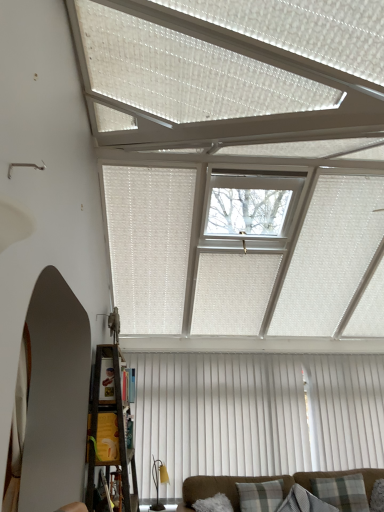
Image resolution: width=384 pixels, height=512 pixels. What do you see at coordinates (342, 492) in the screenshot? I see `plaid fabric pillow at lower right, which is the 3th pillow in left-to-right order` at bounding box center [342, 492].

The width and height of the screenshot is (384, 512). I want to click on white vertical blinds at center, so click(255, 415).

What do you see at coordinates (260, 496) in the screenshot? The image size is (384, 512). I see `plaid fabric pillow at lower center, which appears as the 1th pillow when viewed from the left` at bounding box center [260, 496].

At what (x,y) coordinates should I click in order to perform the action: click on brown fabric couch at lower center. Please return your answer as a coordinate pair (x, y). Looking at the image, I should click on (261, 481).

From the picture: What's the angular difference between plaid fabric pillow at lower center, the 3th pillow when ordered from right to left, and wooden bookshelf at lower left's facing directions?

77.1 degrees.

Considering the sizes of plaid fabric pillow at lower center, the 3th pillow when ordered from right to left, and wooden bookshelf at lower left in the image, is plaid fabric pillow at lower center, the 3th pillow when ordered from right to left, taller or shorter than wooden bookshelf at lower left?

plaid fabric pillow at lower center, the 3th pillow when ordered from right to left, is shorter than wooden bookshelf at lower left.

In the scene shown: From a real-world perspective, which is physically above, plaid fabric pillow at lower center, the 3th pillow when ordered from right to left, or wooden bookshelf at lower left?

From a 3D spatial view, wooden bookshelf at lower left is above.

Between plaid fabric pillow at lower center, the 3th pillow when ordered from right to left, and wooden bookshelf at lower left, which one has larger width?

wooden bookshelf at lower left.

Which of these two, white vertical blinds at center or plaid fabric pillow at lower right, the 1th pillow viewed from the right, is smaller?

Smaller between the two is plaid fabric pillow at lower right, the 1th pillow viewed from the right.

How much distance is there between white vertical blinds at center and plaid fabric pillow at lower right, which is the 3th pillow in left-to-right order?

white vertical blinds at center is 34.30 inches away from plaid fabric pillow at lower right, which is the 3th pillow in left-to-right order.

In order to click on curtain behind the plaid fabric pillow at lower right, which is the 3th pillow in left-to-right order in this screenshot , I will do `click(255, 415)`.

Which object is thinner, white vertical blinds at center or plaid fabric pillow at lower right, the 1th pillow viewed from the right?

Thinner between the two is white vertical blinds at center.

Is wooden bookshelf at lower left with white vertical blinds at center?

wooden bookshelf at lower left is not next to white vertical blinds at center, and they're not touching.

Is wooden bookshelf at lower left facing away from white vertical blinds at center?

No.

In the image, is wooden bookshelf at lower left on the left side or the right side of white vertical blinds at center?

From the image, it's evident that wooden bookshelf at lower left is to the left of white vertical blinds at center.

How much distance is there between brown fabric couch at lower center and plaid fabric pillow at center, positioned as the 2th pillow in left-to-right order?

They are 11.79 inches apart.

Find the location of a particular element. This screenshot has width=384, height=512. the 1st pillow to the right of the brown fabric couch at lower center, starting your count from the anchor is located at coordinates (304, 502).

Does brown fabric couch at lower center turn towards plaid fabric pillow at center, positioned as the 2th pillow in left-to-right order?

Yes, brown fabric couch at lower center is oriented towards plaid fabric pillow at center, positioned as the 2th pillow in left-to-right order.

Is brown fabric couch at lower center beside plaid fabric pillow at center, positioned as the 2th pillow in left-to-right order?

No, brown fabric couch at lower center is not next to plaid fabric pillow at center, positioned as the 2th pillow in left-to-right order.

From a real-world perspective, relative to plaid fabric pillow at lower right, the 1th pillow viewed from the right, is brown fabric couch at lower center vertically above or below?

From a real-world perspective, brown fabric couch at lower center is physically below plaid fabric pillow at lower right, the 1th pillow viewed from the right.

From the picture: Considering the positions of objects brown fabric couch at lower center and plaid fabric pillow at lower right, which is the 3th pillow in left-to-right order, in the image provided, who is more to the right, brown fabric couch at lower center or plaid fabric pillow at lower right, which is the 3th pillow in left-to-right order,?

From the viewer's perspective, plaid fabric pillow at lower right, which is the 3th pillow in left-to-right order, appears more on the right side.

Is brown fabric couch at lower center wider or thinner than plaid fabric pillow at lower right, the 1th pillow viewed from the right?

In the image, brown fabric couch at lower center appears to be wider than plaid fabric pillow at lower right, the 1th pillow viewed from the right.

Are plaid fabric pillow at center, positioned as the 2th pillow in left-to-right order, and brown fabric couch at lower center far apart?

No, plaid fabric pillow at center, positioned as the 2th pillow in left-to-right order, is in close proximity to brown fabric couch at lower center.

Considering the sizes of objects plaid fabric pillow at center, positioned as the 2th pillow in left-to-right order, and brown fabric couch at lower center in the image provided, who is smaller, plaid fabric pillow at center, positioned as the 2th pillow in left-to-right order, or brown fabric couch at lower center?

Smaller between the two is plaid fabric pillow at center, positioned as the 2th pillow in left-to-right order.

Is plaid fabric pillow at center, positioned as the 2th pillow in left-to-right order, turned away from brown fabric couch at lower center?

Yes, plaid fabric pillow at center, positioned as the 2th pillow in left-to-right order,'s orientation is away from brown fabric couch at lower center.

Is point (276, 511) positioned after point (345, 498)?

No, it is not.

From a real-world perspective, is plaid fabric pillow at center, positioned as the 2th pillow in left-to-right order, located higher than plaid fabric pillow at lower right, the 1th pillow viewed from the right?

No, from a real-world perspective, plaid fabric pillow at center, positioned as the 2th pillow in left-to-right order, is not above plaid fabric pillow at lower right, the 1th pillow viewed from the right.

Is plaid fabric pillow at center, the 2th pillow when ordered from right to left, to the left or to the right of plaid fabric pillow at lower right, the 1th pillow viewed from the right, in the image?

In the image, plaid fabric pillow at center, the 2th pillow when ordered from right to left, appears on the left side of plaid fabric pillow at lower right, the 1th pillow viewed from the right.

Find the location of a particular element. the 1st pillow below the plaid fabric pillow at lower right, which is the 3th pillow in left-to-right order (from the image's perspective) is located at coordinates (304, 502).

Identify the location of shelf on the left side of plaid fabric pillow at lower center, the 3th pillow when ordered from right to left. (114, 419).

From a real-world perspective, starting from the white vertical blinds at center, which pillow is the 1st one below it? Please provide its 2D coordinates.

[(342, 492)]

When comparing their distances from white vertical blinds at center, does clear glass window at center or brown fabric couch at lower center seem further?

Among the two, clear glass window at center is located further to white vertical blinds at center.

Looking at the image, which one is located closer to white vertical blinds at center, plaid fabric pillow at lower right, which is the 3th pillow in left-to-right order, or wooden bookshelf at lower left?

plaid fabric pillow at lower right, which is the 3th pillow in left-to-right order, is positioned closer to the anchor white vertical blinds at center.

Considering their positions, is plaid fabric pillow at lower right, the 1th pillow viewed from the right, positioned further to clear glass window at center than wooden bookshelf at lower left?

Based on the image, plaid fabric pillow at lower right, the 1th pillow viewed from the right, appears to be further to clear glass window at center.

Based on their spatial positions, is white vertical blinds at center or wooden bookshelf at lower left closer to plaid fabric pillow at center, the 2th pillow when ordered from right to left?

The object closer to plaid fabric pillow at center, the 2th pillow when ordered from right to left, is white vertical blinds at center.

Estimate the real-world distances between objects in this image. Which object is further from white vertical blinds at center, plaid fabric pillow at lower center, which appears as the 1th pillow when viewed from the left, or plaid fabric pillow at lower right, the 1th pillow viewed from the right?

plaid fabric pillow at lower right, the 1th pillow viewed from the right, is further to white vertical blinds at center.

From the image, which object appears to be nearer to plaid fabric pillow at center, the 2th pillow when ordered from right to left, clear glass window at center or plaid fabric pillow at lower right, the 1th pillow viewed from the right?

The object closer to plaid fabric pillow at center, the 2th pillow when ordered from right to left, is plaid fabric pillow at lower right, the 1th pillow viewed from the right.

From the picture: Estimate the real-world distances between objects in this image. Which object is further from clear glass window at center, plaid fabric pillow at center, the 2th pillow when ordered from right to left, or plaid fabric pillow at lower center, which appears as the 1th pillow when viewed from the left?

plaid fabric pillow at center, the 2th pillow when ordered from right to left, is further to clear glass window at center.

From the image, which object appears to be nearer to clear glass window at center, brown fabric couch at lower center or plaid fabric pillow at lower center, the 3th pillow when ordered from right to left?

plaid fabric pillow at lower center, the 3th pillow when ordered from right to left, is closer to clear glass window at center.

Image resolution: width=384 pixels, height=512 pixels. What are the coordinates of `curtain between clear glass window at center and plaid fabric pillow at center, the 2th pillow when ordered from right to left, vertically` in the screenshot? It's located at (255, 415).

I want to click on curtain between plaid fabric pillow at lower center, which appears as the 1th pillow when viewed from the left, and plaid fabric pillow at lower right, the 1th pillow viewed from the right, so click(x=255, y=415).

Locate an element on the screen. This screenshot has width=384, height=512. curtain between clear glass window at center and plaid fabric pillow at lower center, which appears as the 1th pillow when viewed from the left, vertically is located at coordinates (255, 415).

The image size is (384, 512). I want to click on curtain between wooden bookshelf at lower left and plaid fabric pillow at center, the 2th pillow when ordered from right to left, so click(x=255, y=415).